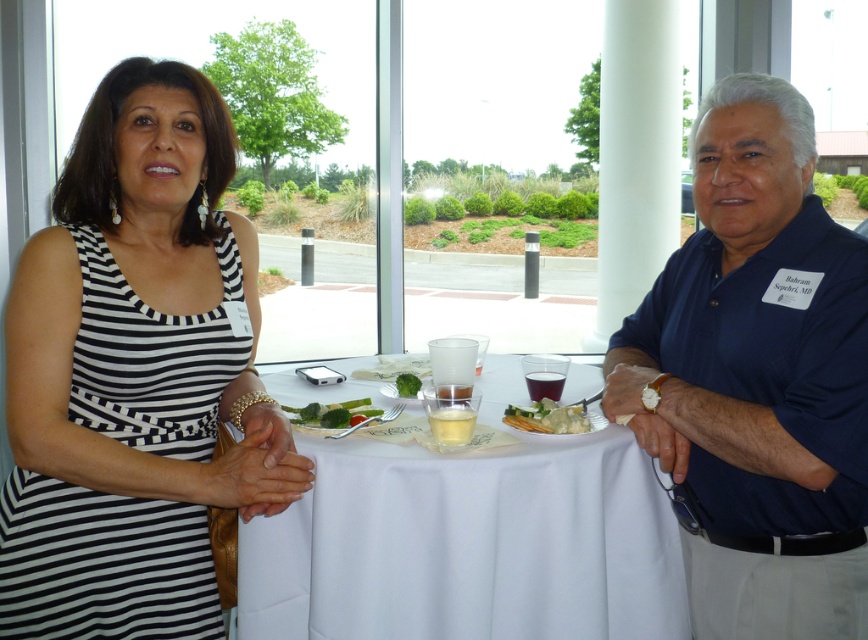
You are a guest at this event and want to choose between the white creamy sauce at center and the green leafy vegetable at center. Which one is bigger in size?

The white creamy sauce at center is larger in size than the green leafy vegetable at center.

You are a guest at this event and want to eat the green leafy vegetable at center before the white creamy sauce at center. Which one should you pick up first?

You should pick up the green leafy vegetable at center first because it is placed above the white creamy sauce at center.